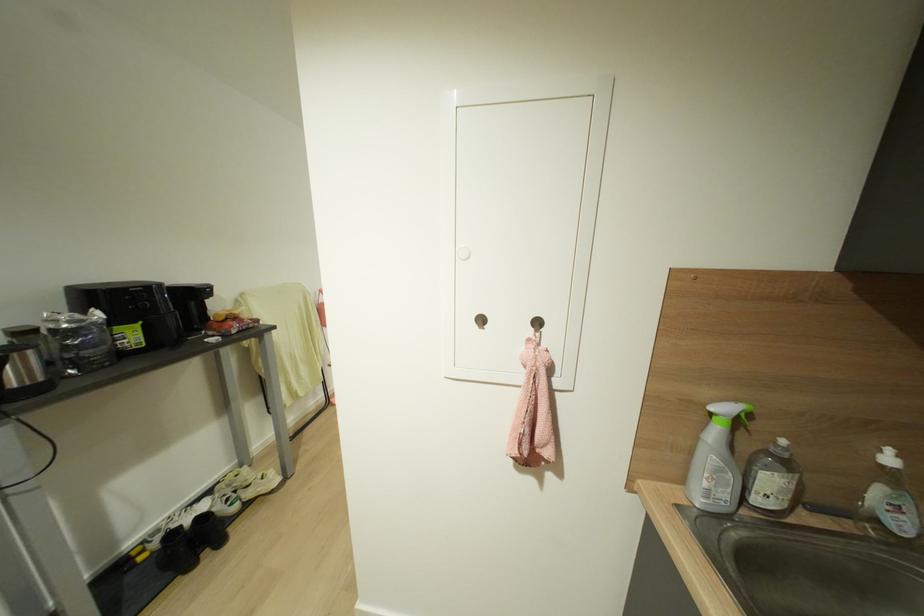
What are the coordinates of `white cabinet knob` in the screenshot? It's located at click(463, 253).